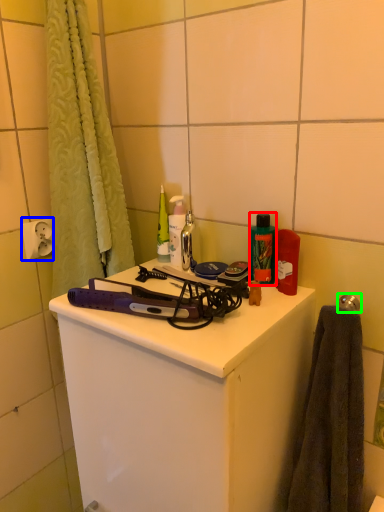
Question: Which object is the closest to the toiletry (highlighted by a red box)? Choose among these: electric outlet (highlighted by a blue box) or towel bar (highlighted by a green box).

Choices:
 (A) electric outlet
 (B) towel bar

Answer: (B)